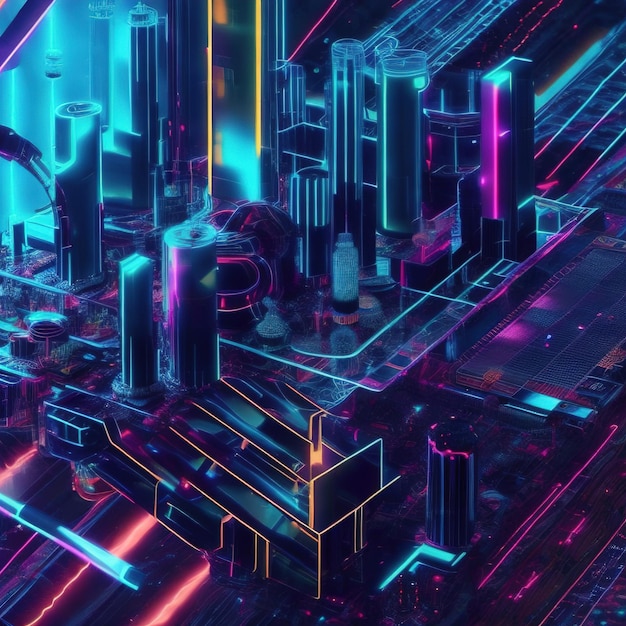
Where is `blue lights`? blue lights is located at coordinates (53, 37), (120, 121), (230, 146), (95, 546), (560, 83), (498, 76).